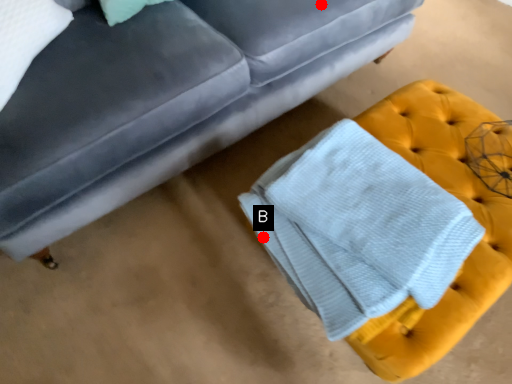
Question: Two points are circled on the image, labeled by A and B beside each circle. Which point is closer to the camera?

Choices:
 (A) A is closer
 (B) B is closer

Answer: (B)